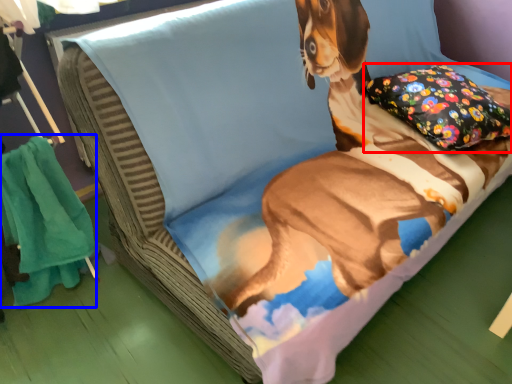
Question: Which of the following is the closest to the observer, pillow (highlighted by a red box) or blanket (highlighted by a blue box)?

Choices:
 (A) pillow
 (B) blanket

Answer: (B)